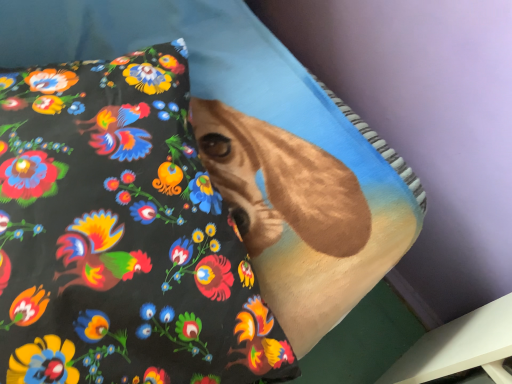
Identify the location of floral fabric pillow at center. (121, 235).

What do you see at coordinates (121, 235) in the screenshot?
I see `floral fabric pillow at center` at bounding box center [121, 235].

The height and width of the screenshot is (384, 512). Identify the location of floral fabric pillow at center. (121, 235).